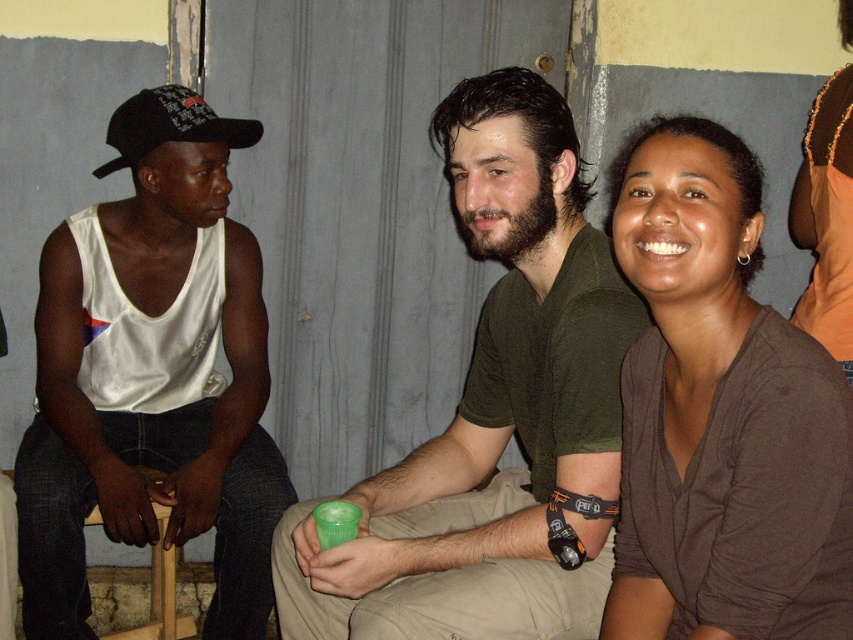
Can you confirm if white matte tank top at left is shorter than wooden chair at lower left?

No.

The width and height of the screenshot is (853, 640). What do you see at coordinates (152, 376) in the screenshot? I see `white matte tank top at left` at bounding box center [152, 376].

Is point (59, 284) farther from viewer compared to point (151, 588)?

No, it is not.

The image size is (853, 640). Find the location of `white matte tank top at left`. white matte tank top at left is located at coordinates (152, 376).

Which is more to the right, green matte cup at center or brown soft shirt at upper right?

Answer: brown soft shirt at upper right is more to the right.

Who is lower down, green matte cup at center or brown soft shirt at upper right?

green matte cup at center

Where is `green matte cup at center`? green matte cup at center is located at coordinates (494, 412).

Is brown soft shirt at upper right bigger than wooden chair at lower left?

Yes, brown soft shirt at upper right is bigger than wooden chair at lower left.

Is brown soft shirt at upper right closer to camera compared to wooden chair at lower left?

Yes, it is in front of wooden chair at lower left.

Measure the distance between brown soft shirt at upper right and camera.

They are 1.16 meters apart.

Find the location of `brown soft shirt at upper right`. brown soft shirt at upper right is located at coordinates (721, 416).